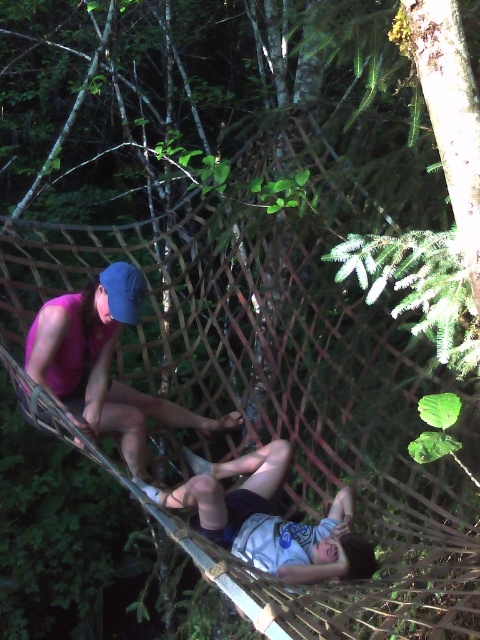
Question: Which point is farther to the camera?

Choices:
 (A) (168, 497)
 (B) (117, 406)

Answer: (B)

Question: Is matte pink shorts at center positioned at the back of white cotton shirt at center?

Choices:
 (A) no
 (B) yes

Answer: (B)

Question: In this image, where is matte pink shorts at center located relative to white cotton shirt at center?

Choices:
 (A) above
 (B) below

Answer: (A)

Question: Which point is closer to the camera?

Choices:
 (A) matte pink shorts at center
 (B) white cotton shirt at center

Answer: (B)

Question: Observing the image, what is the correct spatial positioning of matte pink shorts at center in reference to white cotton shirt at center?

Choices:
 (A) above
 (B) below

Answer: (A)